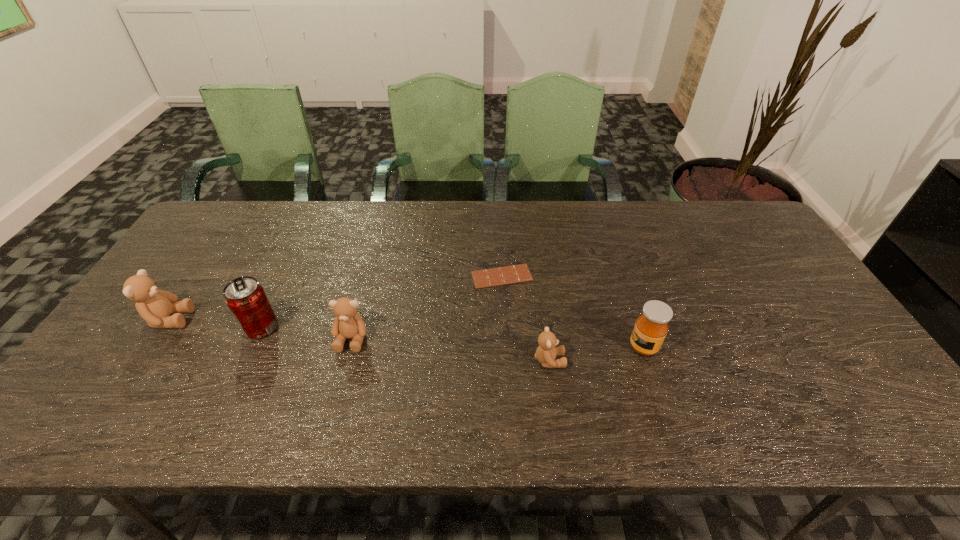
The image size is (960, 540). What are the coordinates of `unoccupied area between the third object from left to right and the honey` in the screenshot? It's located at (497, 343).

This screenshot has width=960, height=540. I want to click on vacant space that is in between the leftmost object and the pop soda, so click(215, 323).

Where is `unoccupied area between the honey and the rightmost teddy bear`? unoccupied area between the honey and the rightmost teddy bear is located at coordinates (596, 354).

Identify the location of unoccupied area between the leftmost teddy bear and the shortest object. The image size is (960, 540). click(x=336, y=298).

Where is `free space between the honey and the pop soda`? free space between the honey and the pop soda is located at coordinates (452, 337).

Where is `object that ranks as the fourth closest to the shortest teddy bear`? This screenshot has width=960, height=540. object that ranks as the fourth closest to the shortest teddy bear is located at coordinates (246, 299).

Identify which object is the fourth nearest to the second teddy bear from right to left. Please provide its 2D coordinates. Your answer should be formatted as a tuple, i.e. [(x, y)], where the tuple contains the x and y coordinates of a point satisfying the conditions above.

[(546, 352)]

Identify which teddy bear is the second closest to the pop soda. Please provide its 2D coordinates. Your answer should be formatted as a tuple, i.e. [(x, y)], where the tuple contains the x and y coordinates of a point satisfying the conditions above.

[(348, 324)]

Identify which teddy bear is located as the second nearest to the leftmost object. Please provide its 2D coordinates. Your answer should be formatted as a tuple, i.e. [(x, y)], where the tuple contains the x and y coordinates of a point satisfying the conditions above.

[(546, 352)]